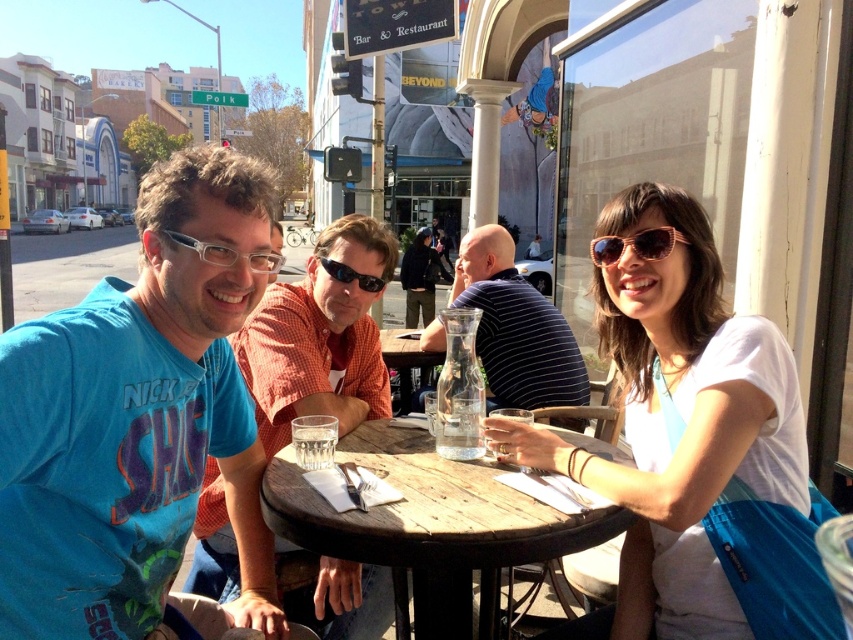
You are a waiter at the Polk Street cafe and need to deliver a drink to the clear glass at table center. If you are standing 5 feet away from the table, can you reach the glass without moving closer?

→ The clear glass at table center is 5.36 feet away from you, so you cannot reach it without moving closer since you are currently 5 feet away.